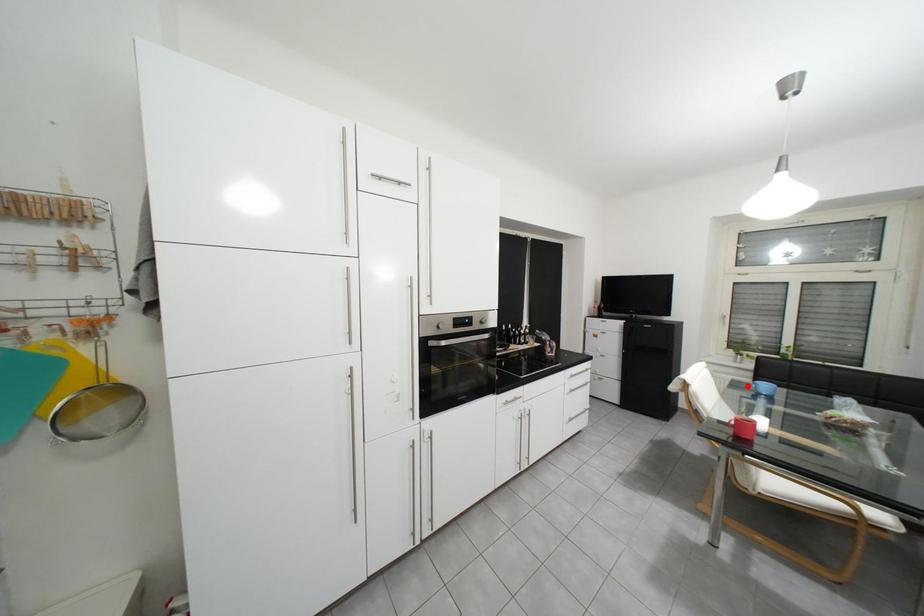
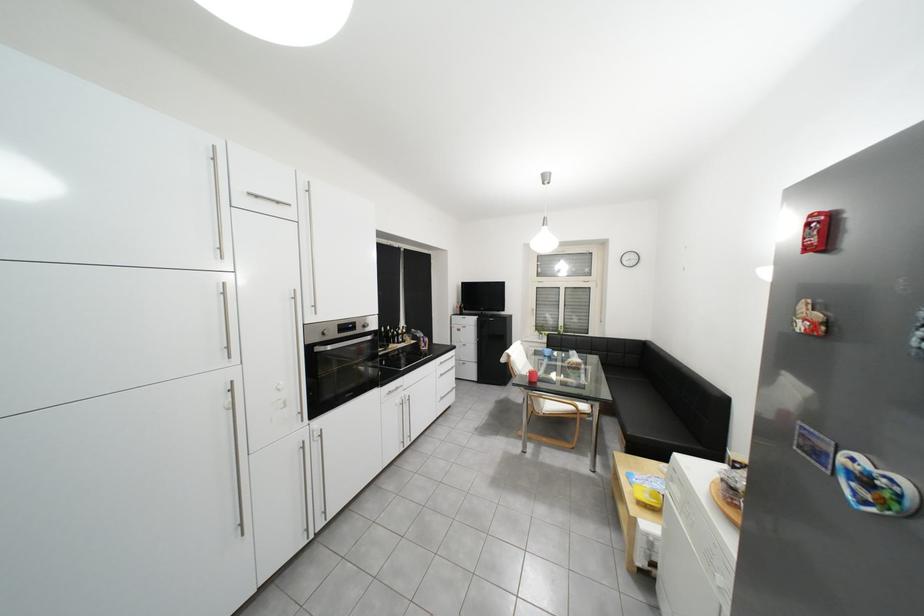
Question: I am providing you with two images of the same scene from different viewpoints. Given a red point in image1, look at the same physical point in image2. Is it:

Choices:
 (A) Closer to the viewpoint
 (B) Farther from the viewpoint

Answer: (B)